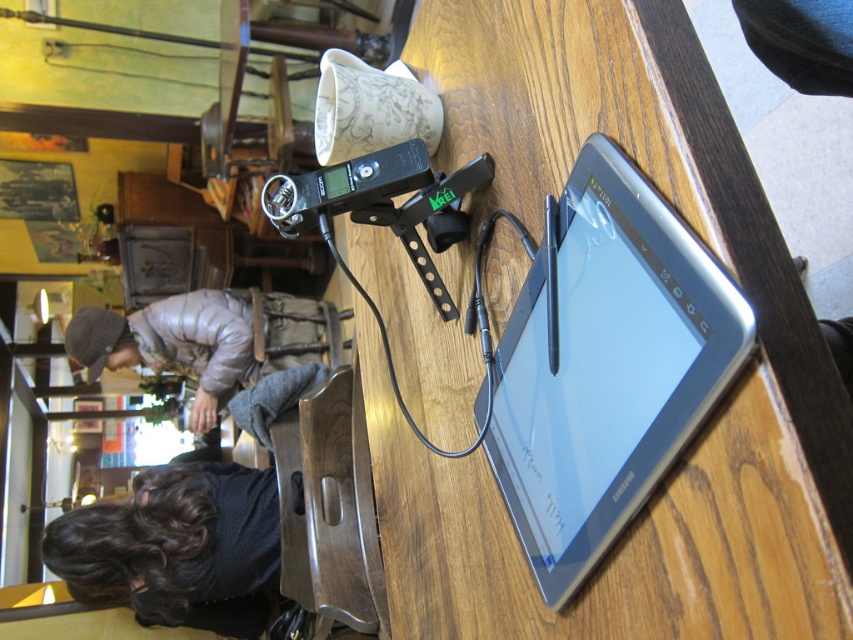
Which of these two, wooden table at center or gray down jacket at lower left, stands taller?

wooden table at center

Who is more forward, (625, 541) or (178, 346)?

Positioned in front is point (625, 541).

Where is `wooden table at center`? This screenshot has height=640, width=853. wooden table at center is located at coordinates (711, 416).

Based on the photo, does wooden table at center appear under dark curly hair at lower left?

Actually, wooden table at center is above dark curly hair at lower left.

Which is behind, point (599, 56) or point (273, 547)?

The point (273, 547) is more distant.

The height and width of the screenshot is (640, 853). I want to click on wooden table at center, so click(711, 416).

Locate an element on the screen. This screenshot has width=853, height=640. wooden table at center is located at coordinates (711, 416).

Can you confirm if silver metallic tablet at center is positioned below gray down jacket at lower left?

Incorrect, silver metallic tablet at center is not positioned below gray down jacket at lower left.

Is silver metallic tablet at center to the right of gray down jacket at lower left from the viewer's perspective?

Correct, you'll find silver metallic tablet at center to the right of gray down jacket at lower left.

Which is in front, point (517, 406) or point (186, 365)?

Point (517, 406) is more forward.

Find the location of a particular element. The width and height of the screenshot is (853, 640). silver metallic tablet at center is located at coordinates (607, 365).